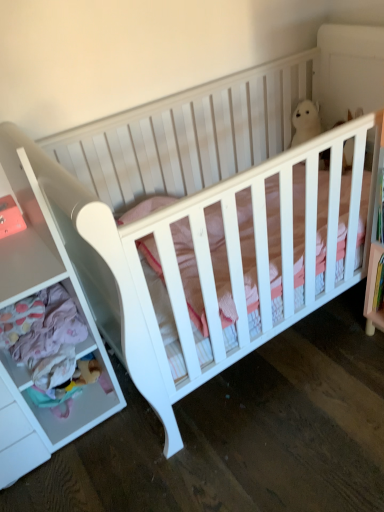
Question: Considering the positions of soft plush bear at lower left and white plush bear at upper center in the image, is soft plush bear at lower left taller or shorter than white plush bear at upper center?

Choices:
 (A) short
 (B) tall

Answer: (A)

Question: Considering the positions of soft plush bear at lower left and white plush bear at upper center in the image, is soft plush bear at lower left bigger or smaller than white plush bear at upper center?

Choices:
 (A) small
 (B) big

Answer: (A)

Question: Which is farther from the soft plush bear at lower left?

Choices:
 (A) white plush bear at upper center
 (B) white matte drawer at left

Answer: (A)

Question: Based on their relative distances, which object is nearer to the soft plush bear at lower left?

Choices:
 (A) white plush bear at upper center
 (B) white matte drawer at left

Answer: (B)